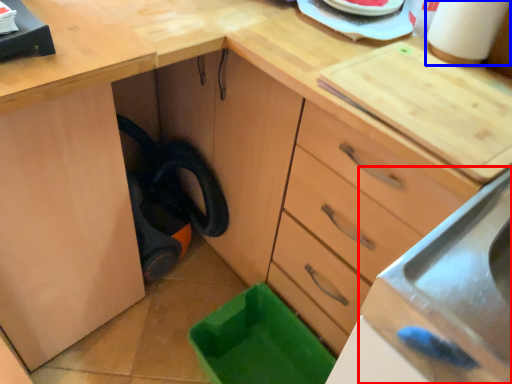
Question: Which point is further to the camera, sink (highlighted by a red box) or paper towel (highlighted by a blue box)?

Choices:
 (A) sink
 (B) paper towel

Answer: (B)